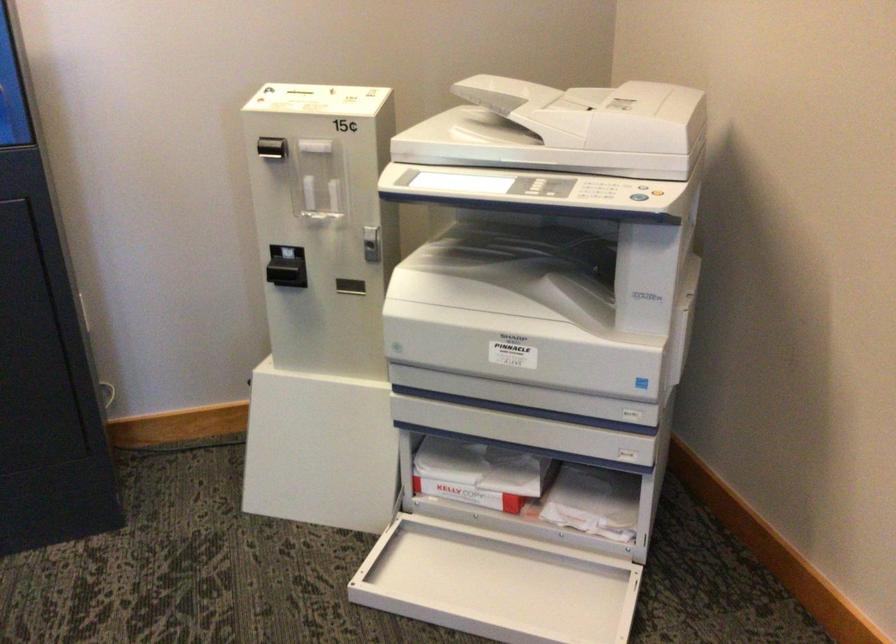
Find the location of a particular element. This screenshot has width=896, height=644. silver coin return is located at coordinates (271, 147).